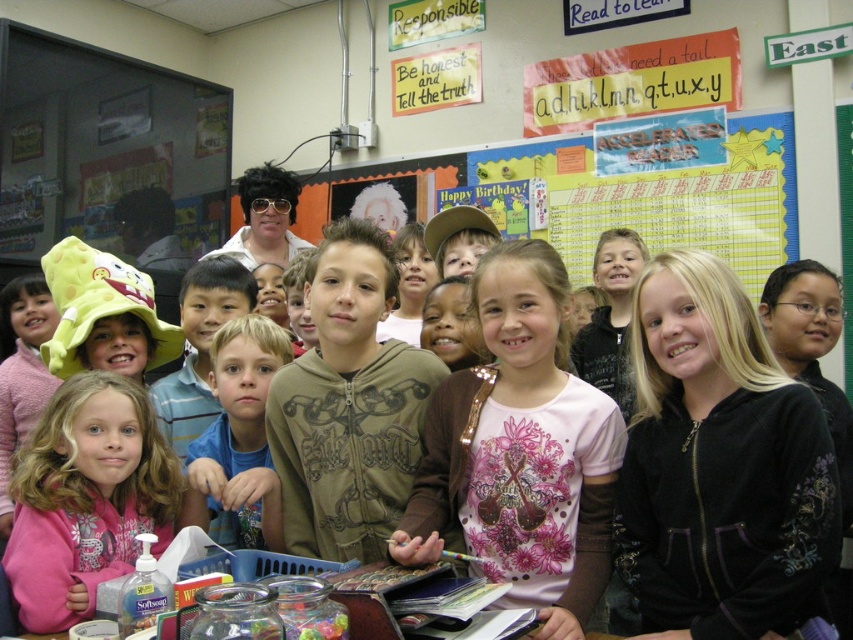
Question: Considering the real-world distances, which object is closest to the blue cotton shirt at center?

Choices:
 (A) pink satin shirt at center
 (B) white wig at center
 (C) pink fleece jacket at lower left
 (D) black velvety hoodie at center

Answer: (C)

Question: Is black velvety hoodie at center below pink satin shirt at center?

Choices:
 (A) no
 (B) yes

Answer: (B)

Question: Which object appears closest to the camera in this image?

Choices:
 (A) blue cotton shirt at center
 (B) pink satin shirt at center
 (C) black velvety hoodie at center

Answer: (C)

Question: Which object is the farthest from the pink satin shirt at center?

Choices:
 (A) black velvety hoodie at center
 (B) pink fleece jacket at lower left
 (C) white wig at center
 (D) blue cotton shirt at center

Answer: (C)

Question: Is pink fleece jacket at lower left below white wig at center?

Choices:
 (A) yes
 (B) no

Answer: (A)

Question: Is pink satin shirt at center thinner than white wig at center?

Choices:
 (A) yes
 (B) no

Answer: (B)